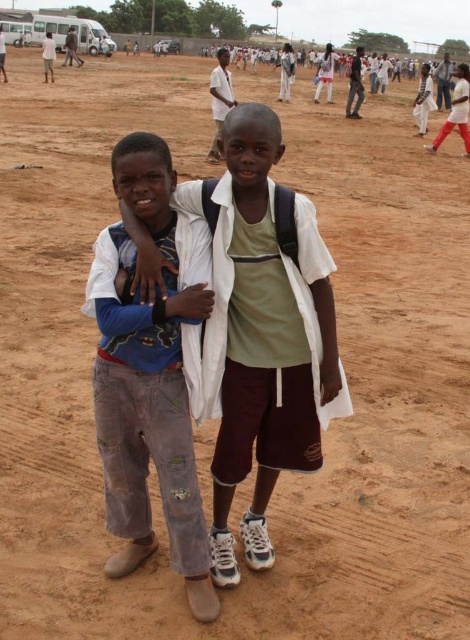
Based on the scene described, which object is wider between the light brown cotton shirt at center and the washed denim pants at center?

The light brown cotton shirt at center is wider than the washed denim pants at center according to the description.

You are a photographer trying to capture a candid shot of the two boys in the scene. You notice the light brown cotton shirt at center and the washed denim pants at center. Which clothing item would block the view of the other if positioned between the camera and the subject?

The light brown cotton shirt at center is bigger than the washed denim pants at center, so if positioned between the camera and the subject, the light brown cotton shirt at center would block the view of the washed denim pants at center.

You are a photographer trying to capture a candid shot of the two boys in the scene. You notice the light brown cotton shirt at center and the washed denim pants at center. Which object is positioned to the right of the other?

→ The light brown cotton shirt at center is to the right of the washed denim pants at center according to the description.